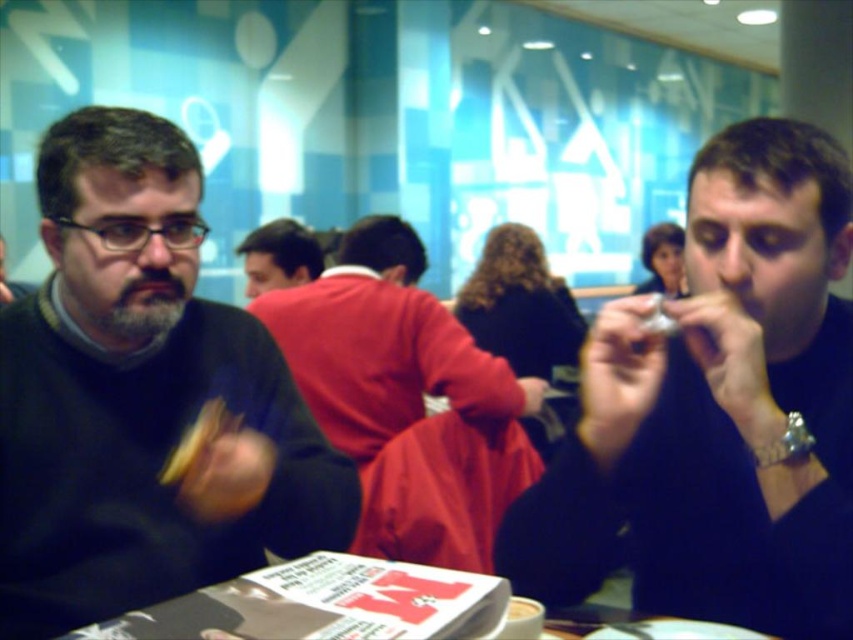
You are standing at the camera position looking at the scene. There are two points in the image labeled point 1 at coordinates point (815, 348) and point 2 at coordinates point (194, 346). Which point is closer to you?

Point 1 at coordinates point (815, 348) is closer to the camera than point 2 at coordinates point (194, 346).

You are a photographer trying to capture a closeup of the black matte shirt at right and the yellow matte bread at left. Based on their sizes in the image, which one would you need to move closer to in order to get a detailed shot?

The yellow matte bread at left is smaller in size compared to the black matte shirt at right. To get a detailed shot, you would need to move closer to the yellow matte bread at left since it is smaller and farther away in the image.